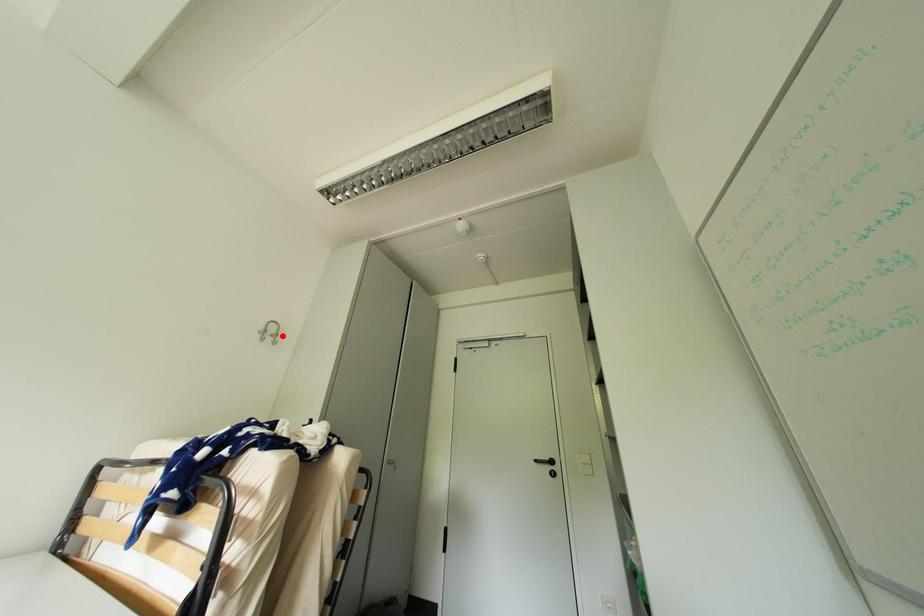
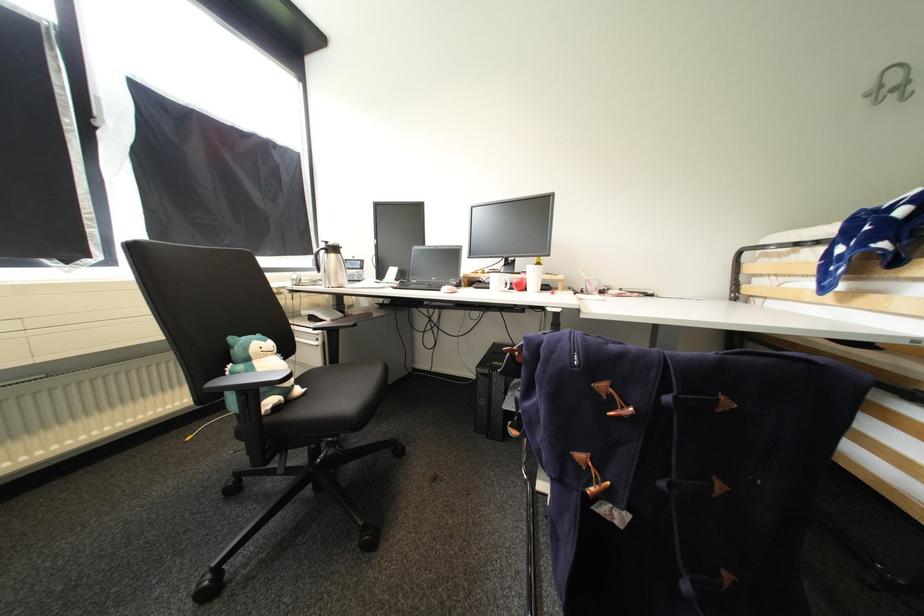
Where in the second image is the point corresponding to the highlighted location from the first image?

(912, 84)